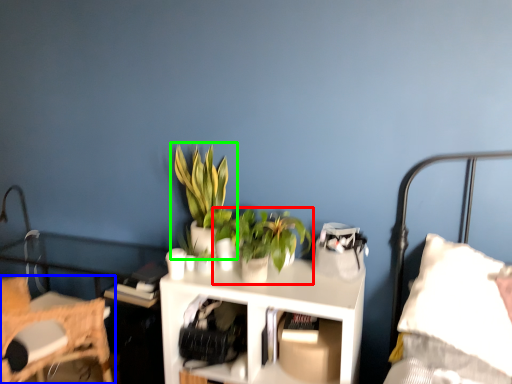
Question: Which object is positioned closest to houseplant (highlighted by a red box)? Select from chair (highlighted by a blue box) and houseplant (highlighted by a green box).

Choices:
 (A) chair
 (B) houseplant

Answer: (B)